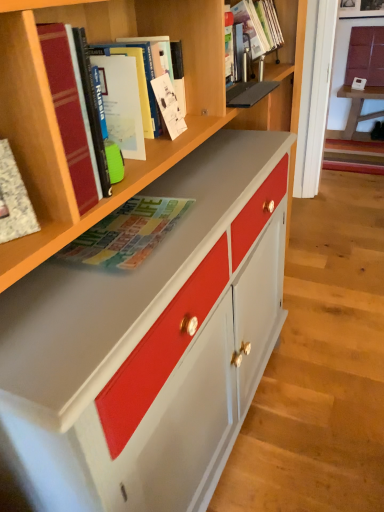
Question: In terms of height, does matte hardcover book at upper center, which is counted as the fourth book, starting from the front, look taller or shorter compared to white textured notebook at left, which is the 6th book from back to front?

Choices:
 (A) short
 (B) tall

Answer: (B)

Question: Considering the positions of point (145, 89) and point (0, 140), is point (145, 89) closer or farther from the camera than point (0, 140)?

Choices:
 (A) closer
 (B) farther

Answer: (B)

Question: Which object is positioned farthest from the hardcover book at upper left, positioned as the second book in front-to-back order?

Choices:
 (A) matte white cabinet at upper right
 (B) matte white table at upper right
 (C) matte plastic book at upper center, which is the 6th book from front to back
 (D) white paper at upper center, the second book from the back
 (E) matte paper map at upper left

Answer: (A)

Question: Based on their relative distances, which object is farther from the matte paper map at upper left?

Choices:
 (A) matte plastic book at upper center, the first book positioned from the back
 (B) white paper at upper center, which appears as the fifth book when viewed from the front
 (C) matte hardcover book at upper center, which is counted as the fourth book, starting from the front
 (D) matte white table at upper right
 (E) matte white cabinet at upper right

Answer: (E)